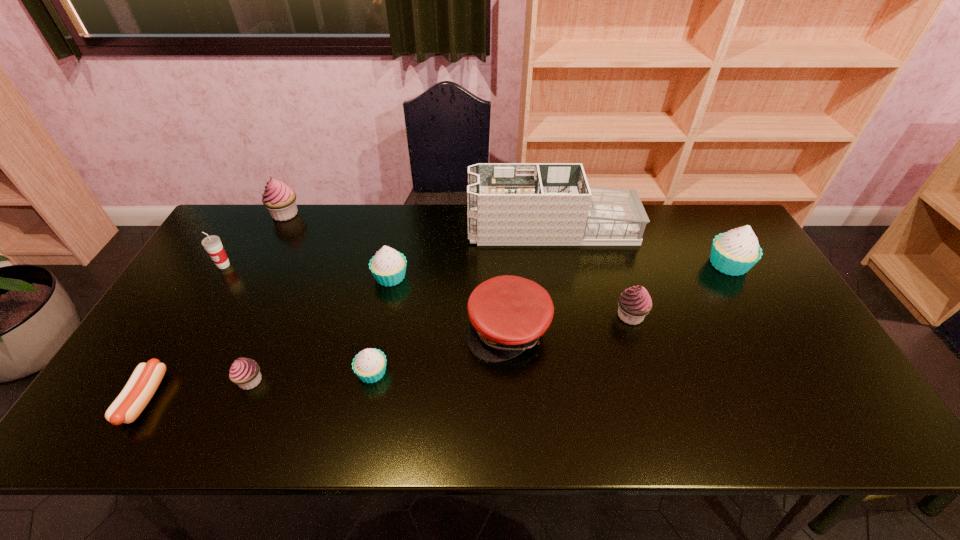
You are a GUI agent. You are given a task and a screenshot of the screen. Output one action in this format:
    pyautogui.click(x=<x>, y=<y>)
    Task: Click on the free location located on the side of the red cup with the logo
    
    Given the screenshot: What is the action you would take?
    coord(192,319)

Find the location of a particular element. The height and width of the screenshot is (540, 960). free space located 0.140m on the back of the second smallest white cupcake is located at coordinates (399, 235).

I want to click on free space located 0.200m on the right of the second smallest pink cupcake, so click(719, 315).

I want to click on vacant region located at the front of the red cap where the visor is located, so click(513, 411).

At what (x,y) coordinates should I click in order to perform the action: click on free space located 0.090m on the back of the nearest white cupcake. Please return your answer as a coordinate pair (x, y). The image size is (960, 540). Looking at the image, I should click on (381, 330).

Locate an element on the screen. The width and height of the screenshot is (960, 540). free space located on the back of the nearest pink cupcake is located at coordinates (296, 273).

This screenshot has height=540, width=960. I want to click on free space located on the back of the sausage, so click(x=208, y=291).

Locate an element on the screen. Image resolution: width=960 pixels, height=540 pixels. dollhouse positioned at the far edge is located at coordinates (508, 203).

At what (x,y) coordinates should I click in order to perform the action: click on object located at the near edge. Please return your answer as a coordinate pair (x, y). Looking at the image, I should click on (144, 381).

Where is `cupcake located at the left edge`? cupcake located at the left edge is located at coordinates tap(280, 199).